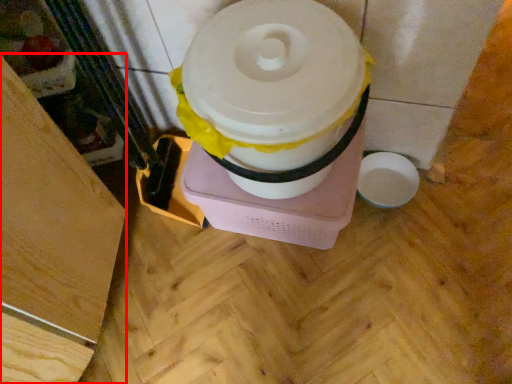
Question: In this image, where is wood (annotated by the red box) located relative to toilet paper?

Choices:
 (A) left
 (B) right

Answer: (A)